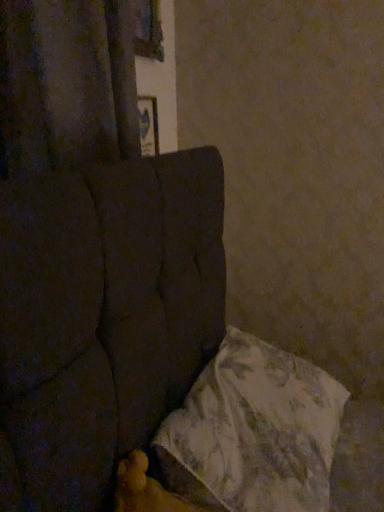
Question: Is fluffy white pillow at lower right located within velvet dark brown curtain at upper left?

Choices:
 (A) no
 (B) yes

Answer: (A)

Question: Does velvet dark brown curtain at upper left appear on the left side of fluffy white pillow at lower right?

Choices:
 (A) yes
 (B) no

Answer: (A)

Question: From a real-world perspective, is velvet dark brown curtain at upper left physically below fluffy white pillow at lower right?

Choices:
 (A) yes
 (B) no

Answer: (B)

Question: From the image's perspective, is velvet dark brown curtain at upper left on top of fluffy white pillow at lower right?

Choices:
 (A) no
 (B) yes

Answer: (B)

Question: Does velvet dark brown curtain at upper left turn towards fluffy white pillow at lower right?

Choices:
 (A) yes
 (B) no

Answer: (B)

Question: From the image's perspective, would you say velvet dark brown curtain at upper left is shown under fluffy white pillow at lower right?

Choices:
 (A) yes
 (B) no

Answer: (B)

Question: Considering the relative sizes of fluffy white pillow at lower right and velvet dark brown curtain at upper left in the image provided, is fluffy white pillow at lower right shorter than velvet dark brown curtain at upper left?

Choices:
 (A) no
 (B) yes

Answer: (B)

Question: Does fluffy white pillow at lower right appear on the left side of velvet dark brown curtain at upper left?

Choices:
 (A) yes
 (B) no

Answer: (B)

Question: Is fluffy white pillow at lower right with velvet dark brown curtain at upper left?

Choices:
 (A) no
 (B) yes

Answer: (A)

Question: Considering the relative sizes of fluffy white pillow at lower right and velvet dark brown curtain at upper left in the image provided, is fluffy white pillow at lower right wider than velvet dark brown curtain at upper left?

Choices:
 (A) no
 (B) yes

Answer: (B)

Question: Is fluffy white pillow at lower right looking in the opposite direction of velvet dark brown curtain at upper left?

Choices:
 (A) no
 (B) yes

Answer: (A)

Question: Is fluffy white pillow at lower right behind velvet dark brown curtain at upper left?

Choices:
 (A) no
 (B) yes

Answer: (A)

Question: From a real-world perspective, is fluffy white pillow at lower right above or below velvet dark brown curtain at upper left?

Choices:
 (A) above
 (B) below

Answer: (B)